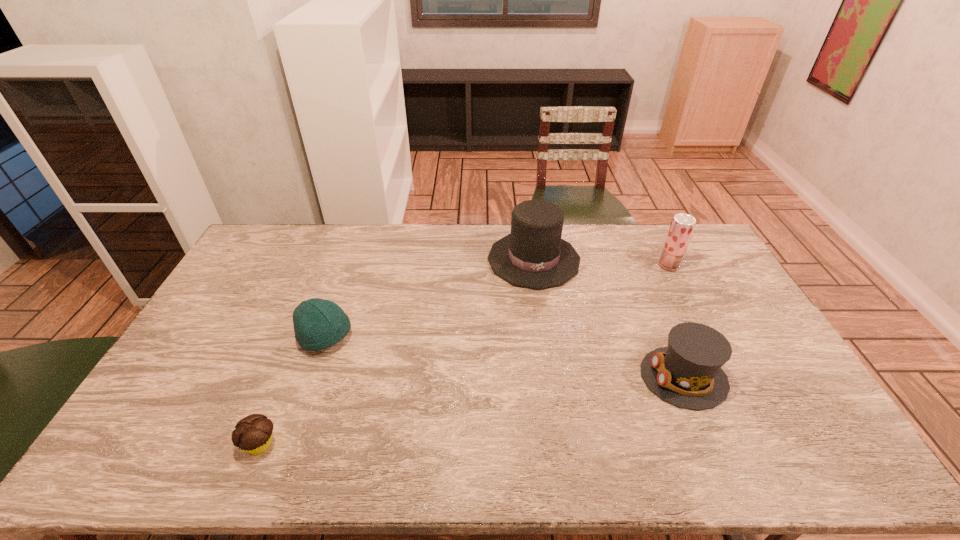
In order to click on the left dress hat in this screenshot , I will do `click(534, 256)`.

Locate an element on the screen. This screenshot has height=540, width=960. the taller dress hat is located at coordinates (534, 256).

The image size is (960, 540). What are the coordinates of `fruit juice` in the screenshot? It's located at (682, 226).

You are a GUI agent. You are given a task and a screenshot of the screen. Output one action in this format:
    pyautogui.click(x=<x>, y=<y>)
    Task: Click on the shorter dress hat
    This screenshot has width=960, height=540.
    Given the screenshot: What is the action you would take?
    pyautogui.click(x=688, y=374)

This screenshot has width=960, height=540. In order to click on the nearer dress hat in this screenshot , I will do `click(688, 374)`.

Where is `the fourth tallest object`? the fourth tallest object is located at coordinates (318, 324).

The image size is (960, 540). What are the coordinates of `the shortest object` in the screenshot? It's located at (253, 434).

This screenshot has height=540, width=960. In order to click on muffin in this screenshot , I will do `click(253, 434)`.

Find the location of a particular element. Image resolution: width=960 pixels, height=540 pixels. vacant region located 0.130m on the front of the taller dress hat with the decoration is located at coordinates (542, 319).

This screenshot has width=960, height=540. In order to click on free space located 0.400m on the left of the fruit juice in this screenshot , I will do `click(549, 265)`.